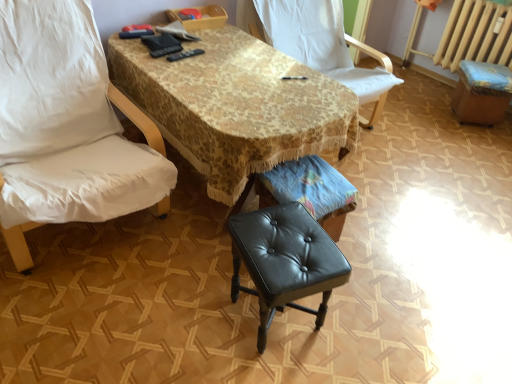
Locate an element on the screen. The image size is (512, 384). free space between black leather music stool at center and black leather bar stool at lower right is located at coordinates (418, 160).